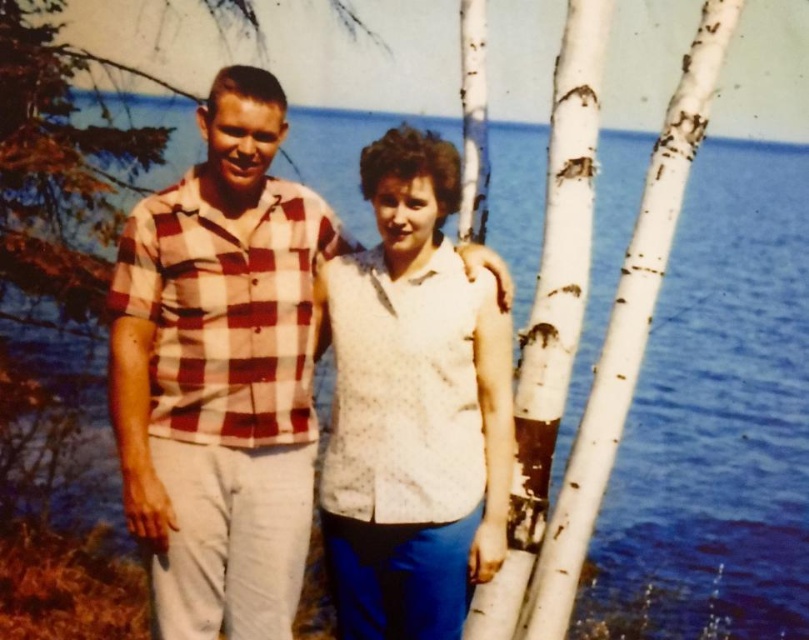
You are a photographer trying to capture a group photo of the checkered fabric shirt at center and the white dotted shirt at center. Since you want to ensure both subjects are in focus, you need to know their height difference. Which shirt is taller?

The checkered fabric shirt at center is much taller than the white dotted shirt at center.

Based on the scene description, which object is positioned higher in the image between the checkered fabric shirt at center and the white dotted shirt at center?

The checkered fabric shirt at center is positioned higher than the white dotted shirt at center according to the description.